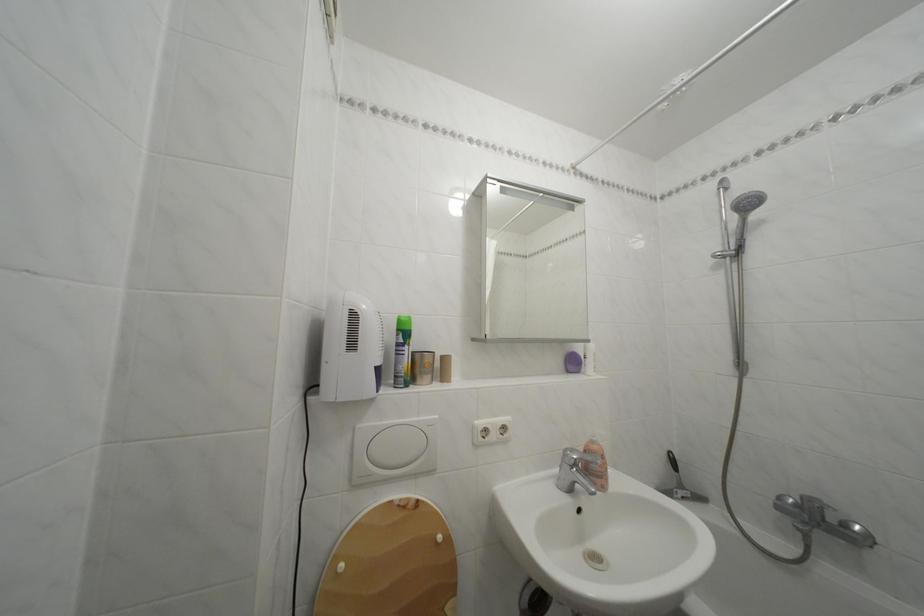
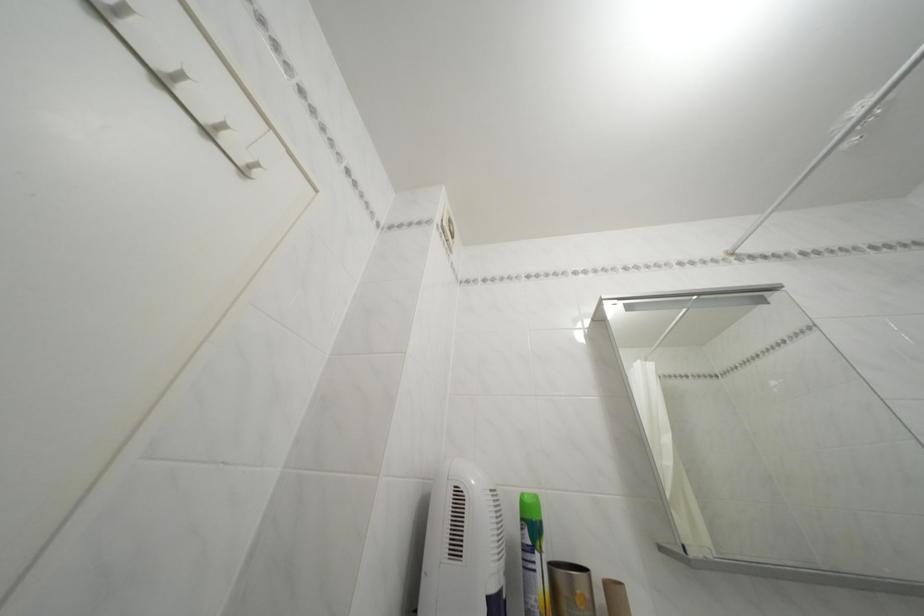
Where in the second image is the point corresponding to the point at 689,84 from the first image?

(869, 114)